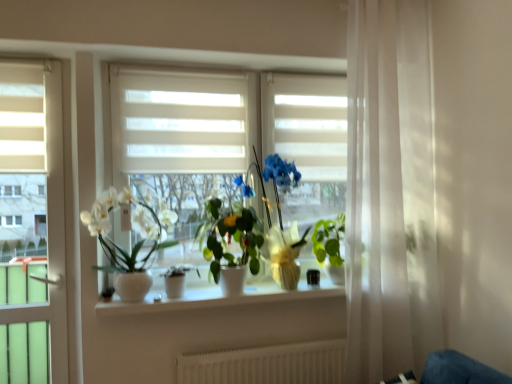
The image size is (512, 384). Find the location of `white matte blind at center, the first blind when ordered from right to left`. white matte blind at center, the first blind when ordered from right to left is located at coordinates (179, 121).

This screenshot has height=384, width=512. What do you see at coordinates (229, 243) in the screenshot?
I see `green glossy plant at center, which appears as the second houseplant when viewed from the right` at bounding box center [229, 243].

What are the coordinates of `green glossy plant at center, which is the third houseplant in left-to-right order` in the screenshot? It's located at (229, 243).

What do you see at coordinates (22, 116) in the screenshot?
I see `white matte blind at upper left, placed as the second blind when sorted from back to front` at bounding box center [22, 116].

What do you see at coordinates (390, 192) in the screenshot? This screenshot has height=384, width=512. I see `white sheer curtain at right` at bounding box center [390, 192].

Find the location of a particular element. Image resolution: width=512 pixels, height=384 pixels. matte white pot at center, which is the 2th houseplant from left to right is located at coordinates (176, 280).

This screenshot has width=512, height=384. I want to click on white textured radiator at lower center, so click(x=266, y=364).

Is white matte blind at center, which is counted as the first blind, starting from the back, located outside white matte blind at upper left, which is the first blind from front to back?

Yes, white matte blind at center, which is counted as the first blind, starting from the back, is not within white matte blind at upper left, which is the first blind from front to back.

Measure the distance from white matte blind at center, which is counted as the first blind, starting from the back, to white matte blind at upper left, the first blind positioned from the left.

20.90 inches.

Identify the location of blind that appears below the white matte blind at upper left, placed as the second blind when sorted from back to front (from the image's perspective). The height and width of the screenshot is (384, 512). (179, 121).

Between white matte blind at center, the 2th blind positioned from the left, and white matte blind at upper left, acting as the second blind starting from the right, which one has larger width?

white matte blind at upper left, acting as the second blind starting from the right, is wider.

In the scene shown: From a real-world perspective, is white textured radiator at lower center positioned above or below white matte blind at center, the 2th blind positioned from the left?

white textured radiator at lower center is situated lower than white matte blind at center, the 2th blind positioned from the left, in the real world.

Considering the sizes of objects white textured radiator at lower center and white matte blind at center, which is the second blind in front-to-back order, in the image provided, who is shorter, white textured radiator at lower center or white matte blind at center, which is the second blind in front-to-back order,?

Standing shorter between the two is white textured radiator at lower center.

From the image's perspective, which one is positioned lower, white textured radiator at lower center or white matte blind at center, the 2th blind positioned from the left?

From the image's view, white textured radiator at lower center is below.

From a real-world perspective, is matte white pot at center, which is the 2th houseplant from left to right, positioned under white matte blind at upper left, the first blind positioned from the left, based on gravity?

Correct, in the physical world, matte white pot at center, which is the 2th houseplant from left to right, is lower than white matte blind at upper left, the first blind positioned from the left.

Considering the relative positions of matte white pot at center, the 3th houseplant when ordered from right to left, and white matte blind at upper left, the first blind positioned from the left, in the image provided, is matte white pot at center, the 3th houseplant when ordered from right to left, to the left or to the right of white matte blind at upper left, the first blind positioned from the left,?

matte white pot at center, the 3th houseplant when ordered from right to left, is to the right of white matte blind at upper left, the first blind positioned from the left.

Is matte white pot at center, the 3th houseplant when ordered from right to left, oriented away from white matte blind at upper left, the first blind positioned from the left?

No, matte white pot at center, the 3th houseplant when ordered from right to left, is not facing the opposite direction of white matte blind at upper left, the first blind positioned from the left.

Which is in front, point (176, 286) or point (22, 105)?

The point (22, 105) is in front.

Which object is further away from the camera taking this photo, matte white pot at center, which is the 2th houseplant from left to right, or white ceramic vase at center?

matte white pot at center, which is the 2th houseplant from left to right, is more distant.

Is white ceramic vase at center at the back of matte white pot at center, which is the 2th houseplant from left to right?

matte white pot at center, which is the 2th houseplant from left to right, does not have its back to white ceramic vase at center.

Is matte white pot at center, which is the 2th houseplant from left to right, to the right of white ceramic vase at center from the viewer's perspective?

In fact, matte white pot at center, which is the 2th houseplant from left to right, is to the left of white ceramic vase at center.

Between matte white pot at center, the 3th houseplant when ordered from right to left, and white ceramic vase at center, which one has larger size?

With larger size is white ceramic vase at center.

Based on the photo, from a real-world perspective, which object rests below the other?

white glossy pot at left, positioned as the 1th houseplant in left-to-right order, from a real-world perspective.

Can we say white glossy pot at left, acting as the fourth houseplant starting from the right, lies outside green glossy plant at center, which is the third houseplant in left-to-right order?

white glossy pot at left, acting as the fourth houseplant starting from the right, is positioned outside green glossy plant at center, which is the third houseplant in left-to-right order.

In the scene shown: Is white glossy pot at left, acting as the fourth houseplant starting from the right, to the right of green glossy plant at center, which appears as the second houseplant when viewed from the right, from the viewer's perspective?

No.

Would you say white glossy pot at left, positioned as the 1th houseplant in left-to-right order, is a long distance from green glossy plant at center, which appears as the second houseplant when viewed from the right?

Actually, white glossy pot at left, positioned as the 1th houseplant in left-to-right order, and green glossy plant at center, which appears as the second houseplant when viewed from the right, are a little close together.

Considering the sizes of objects matte white pot at center, which is the 2th houseplant from left to right, and green glossy plant at center, which appears as the fourth houseplant when viewed from the left, in the image provided, who is shorter, matte white pot at center, which is the 2th houseplant from left to right, or green glossy plant at center, which appears as the fourth houseplant when viewed from the left,?

Standing shorter between the two is matte white pot at center, which is the 2th houseplant from left to right.

Is matte white pot at center, which is the 2th houseplant from left to right, not inside green glossy plant at center, the 1th houseplant viewed from the right?

Yes, matte white pot at center, which is the 2th houseplant from left to right, is outside of green glossy plant at center, the 1th houseplant viewed from the right.

Is matte white pot at center, the 3th houseplant when ordered from right to left, aimed at green glossy plant at center, the 1th houseplant viewed from the right?

No, matte white pot at center, the 3th houseplant when ordered from right to left, is not oriented towards green glossy plant at center, the 1th houseplant viewed from the right.

The height and width of the screenshot is (384, 512). Identify the location of radiator below the green glossy plant at center, which is the third houseplant in left-to-right order (from a real-world perspective). (266, 364).

Is green glossy plant at center, which is the third houseplant in left-to-right order, positioned with its back to white textured radiator at lower center?

No, green glossy plant at center, which is the third houseplant in left-to-right order,'s orientation is not away from white textured radiator at lower center.

Is green glossy plant at center, which is the third houseplant in left-to-right order, spatially inside white textured radiator at lower center, or outside of it?

green glossy plant at center, which is the third houseplant in left-to-right order, is spatially situated outside white textured radiator at lower center.

Considering the relative sizes of green glossy plant at center, which appears as the second houseplant when viewed from the right, and white textured radiator at lower center in the image provided, is green glossy plant at center, which appears as the second houseplant when viewed from the right, bigger than white textured radiator at lower center?

Indeed, green glossy plant at center, which appears as the second houseplant when viewed from the right, has a larger size compared to white textured radiator at lower center.

Image resolution: width=512 pixels, height=384 pixels. What are the coordinates of `blind that appears on the right of white matte blind at upper left, acting as the second blind starting from the right` in the screenshot? It's located at (179, 121).

Where is `the 1st blind positioned above the white textured radiator at lower center (from the image's perspective)`? the 1st blind positioned above the white textured radiator at lower center (from the image's perspective) is located at coordinates (179, 121).

Which object lies further to the anchor point green glossy plant at center, the 1th houseplant viewed from the right, white matte blind at center, which is the second blind in front-to-back order, or green glossy plant at center, which is the third houseplant in left-to-right order?

Among the two, white matte blind at center, which is the second blind in front-to-back order, is located further to green glossy plant at center, the 1th houseplant viewed from the right.

Considering their positions, is white textured radiator at lower center positioned further to green glossy plant at center, which appears as the fourth houseplant when viewed from the left, than white glossy pot at left, acting as the fourth houseplant starting from the right?

Based on the image, white glossy pot at left, acting as the fourth houseplant starting from the right, appears to be further to green glossy plant at center, which appears as the fourth houseplant when viewed from the left.

From the picture: When comparing their distances from white glossy pot at left, positioned as the 1th houseplant in left-to-right order, does white textured radiator at lower center or white ceramic vase at center seem closer?

Among the two, white ceramic vase at center is located nearer to white glossy pot at left, positioned as the 1th houseplant in left-to-right order.

From the picture: When comparing their distances from green glossy plant at center, the 1th houseplant viewed from the right, does matte white pot at center, the 3th houseplant when ordered from right to left, or white glossy pot at left, acting as the fourth houseplant starting from the right, seem further?

Based on the image, white glossy pot at left, acting as the fourth houseplant starting from the right, appears to be further to green glossy plant at center, the 1th houseplant viewed from the right.

Looking at the image, which one is located closer to matte white pot at center, which is the 2th houseplant from left to right, white ceramic vase at center or green glossy plant at center, which appears as the fourth houseplant when viewed from the left?

white ceramic vase at center.

When comparing their distances from green glossy plant at center, which appears as the second houseplant when viewed from the right, does white glossy pot at left, acting as the fourth houseplant starting from the right, or matte white pot at center, the 3th houseplant when ordered from right to left, seem further?

white glossy pot at left, acting as the fourth houseplant starting from the right, lies further to green glossy plant at center, which appears as the second houseplant when viewed from the right, than the other object.

From the image, which object appears to be farther from green glossy plant at center, which is the third houseplant in left-to-right order, white sheer curtain at right or white glossy pot at left, positioned as the 1th houseplant in left-to-right order?

white sheer curtain at right is positioned further to the anchor green glossy plant at center, which is the third houseplant in left-to-right order.

Estimate the real-world distances between objects in this image. Which object is closer to white textured radiator at lower center, green glossy plant at center, which appears as the second houseplant when viewed from the right, or white ceramic vase at center?

Based on the image, white ceramic vase at center appears to be nearer to white textured radiator at lower center.

Where is `window sill that lies between white matte blind at center, the first blind when ordered from right to left, and white textured radiator at lower center from top to bottom`? window sill that lies between white matte blind at center, the first blind when ordered from right to left, and white textured radiator at lower center from top to bottom is located at coordinates (217, 298).

This screenshot has width=512, height=384. Find the location of `window sill situated between green glossy plant at center, which is the third houseplant in left-to-right order, and white sheer curtain at right from left to right`. window sill situated between green glossy plant at center, which is the third houseplant in left-to-right order, and white sheer curtain at right from left to right is located at coordinates (217, 298).

Find the location of a particular element. This screenshot has height=384, width=512. houseplant between white glossy pot at left, acting as the fourth houseplant starting from the right, and green glossy plant at center, which is the third houseplant in left-to-right order, in the horizontal direction is located at coordinates (176, 280).

Locate an element on the screen. The height and width of the screenshot is (384, 512). houseplant between matte white pot at center, which is the 2th houseplant from left to right, and white ceramic vase at center, in the horizontal direction is located at coordinates (229, 243).